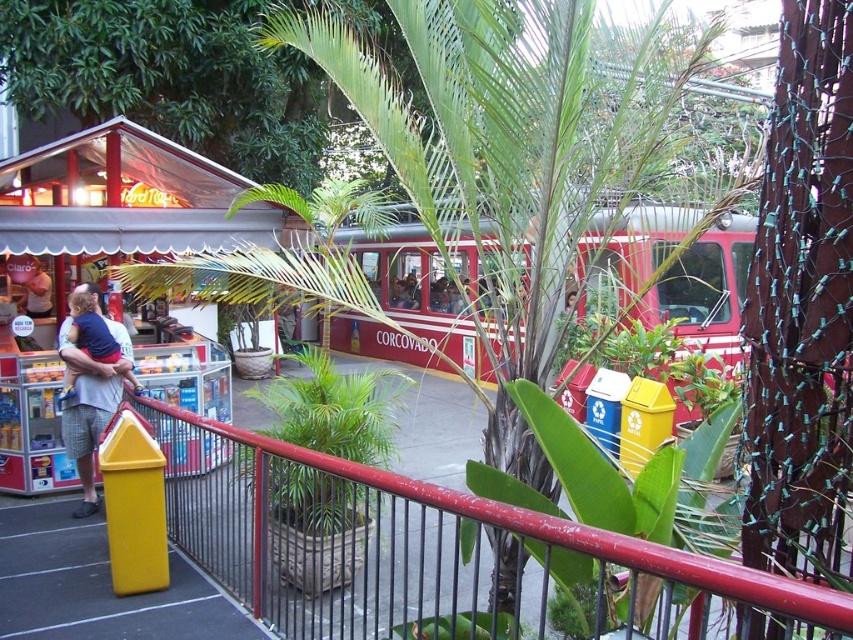
Is metallic red railing at center shorter than red corrugated metal train car at center?

Indeed, metallic red railing at center has a lesser height compared to red corrugated metal train car at center.

Between metallic red railing at center and red corrugated metal train car at center, which one has less height?

metallic red railing at center

What are the coordinates of `metallic red railing at center` in the screenshot? It's located at (422, 550).

You are a GUI agent. You are given a task and a screenshot of the screen. Output one action in this format:
    pyautogui.click(x=<x>, y=<y>)
    Task: Click on the metallic red railing at center
    The height and width of the screenshot is (640, 853).
    Given the screenshot: What is the action you would take?
    pyautogui.click(x=422, y=550)

Is red corrugated metal train car at center shorter than matte white shirt at left?

Incorrect, red corrugated metal train car at center's height does not fall short of matte white shirt at left's.

Does red corrugated metal train car at center have a smaller size compared to matte white shirt at left?

No, red corrugated metal train car at center is not smaller than matte white shirt at left.

Locate an element on the screen. The height and width of the screenshot is (640, 853). red corrugated metal train car at center is located at coordinates (671, 275).

Is metallic red railing at center to the left of matte white shirt at left from the viewer's perspective?

No, metallic red railing at center is not to the left of matte white shirt at left.

Is point (248, 470) closer to viewer compared to point (86, 481)?

Yes, point (248, 470) is closer to viewer.

At what (x,y) coordinates should I click in order to perform the action: click on metallic red railing at center. Please return your answer as a coordinate pair (x, y). Image resolution: width=853 pixels, height=640 pixels. Looking at the image, I should click on (422, 550).